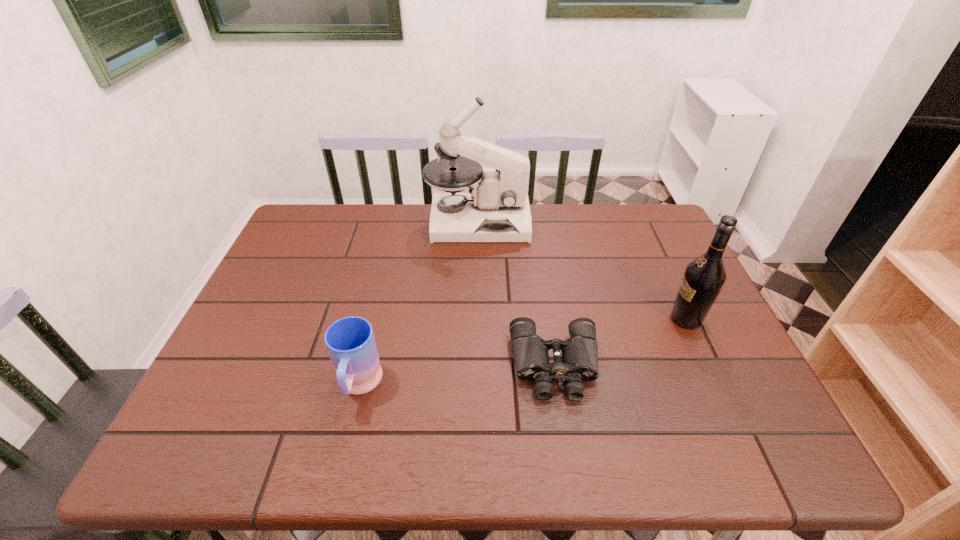
Where is `blank area located 0.120m on the label of the wine bottle`? blank area located 0.120m on the label of the wine bottle is located at coordinates (622, 319).

Locate an element on the screen. The height and width of the screenshot is (540, 960). vacant space situated on the side of the leftmost object with the handle is located at coordinates coord(341,462).

Find the location of `free space located 0.090m through the eyepieces of the shortest object`. free space located 0.090m through the eyepieces of the shortest object is located at coordinates (566, 442).

Find the location of `object that is at the far edge`. object that is at the far edge is located at coordinates (496, 209).

Locate an element on the screen. The width and height of the screenshot is (960, 540). object at the right edge is located at coordinates (704, 277).

In order to click on free space at the far edge of the desktop in this screenshot , I will do `click(489, 245)`.

Locate an element on the screen. The image size is (960, 540). free space at the near edge of the desktop is located at coordinates (372, 443).

This screenshot has width=960, height=540. I want to click on vacant space at the left edge of the desktop, so click(206, 417).

At what (x,y) coordinates should I click in order to perform the action: click on vacant point at the right edge. Please return your answer as a coordinate pair (x, y). Looking at the image, I should click on (679, 369).

Where is `vacant space at the far left corner`? vacant space at the far left corner is located at coordinates (340, 226).